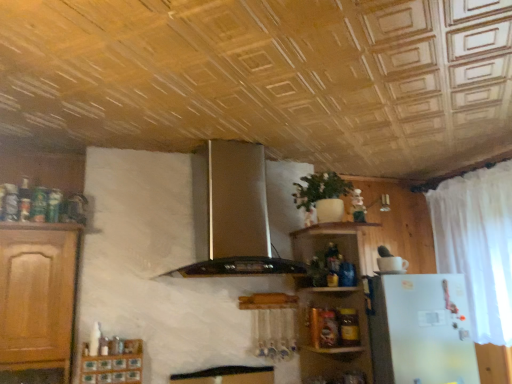
Question: Should I look upward or downward to see wooden shelves at upper right?

Choices:
 (A) up
 (B) down

Answer: (B)

Question: Can wooden spice rack at lower left be found inside satin silver exhaust hood at center?

Choices:
 (A) no
 (B) yes

Answer: (A)

Question: Is satin silver exhaust hood at center oriented towards wooden spice rack at lower left?

Choices:
 (A) no
 (B) yes

Answer: (A)

Question: Is satin silver exhaust hood at center thinner than wooden spice rack at lower left?

Choices:
 (A) no
 (B) yes

Answer: (A)

Question: Considering the relative sizes of satin silver exhaust hood at center and wooden spice rack at lower left in the image provided, is satin silver exhaust hood at center bigger than wooden spice rack at lower left?

Choices:
 (A) yes
 (B) no

Answer: (A)

Question: Can you confirm if satin silver exhaust hood at center is taller than wooden spice rack at lower left?

Choices:
 (A) no
 (B) yes

Answer: (B)

Question: Does satin silver exhaust hood at center have a lesser height compared to wooden spice rack at lower left?

Choices:
 (A) yes
 (B) no

Answer: (B)

Question: Does satin silver exhaust hood at center turn towards green matte plant at center?

Choices:
 (A) yes
 (B) no

Answer: (B)

Question: Considering the relative positions of satin silver exhaust hood at center and green matte plant at center in the image provided, is satin silver exhaust hood at center to the left of green matte plant at center from the viewer's perspective?

Choices:
 (A) yes
 (B) no

Answer: (A)

Question: From the image's perspective, is satin silver exhaust hood at center on top of green matte plant at center?

Choices:
 (A) no
 (B) yes

Answer: (A)

Question: Does satin silver exhaust hood at center have a greater height compared to green matte plant at center?

Choices:
 (A) no
 (B) yes

Answer: (B)

Question: Considering the relative positions of satin silver exhaust hood at center and green matte plant at center in the image provided, is satin silver exhaust hood at center to the right of green matte plant at center from the viewer's perspective?

Choices:
 (A) yes
 (B) no

Answer: (B)

Question: From a real-world perspective, is satin silver exhaust hood at center positioned over green matte plant at center based on gravity?

Choices:
 (A) yes
 (B) no

Answer: (B)

Question: From the image's perspective, is wooden shelves at upper right located beneath wooden spice rack at lower left?

Choices:
 (A) yes
 (B) no

Answer: (B)